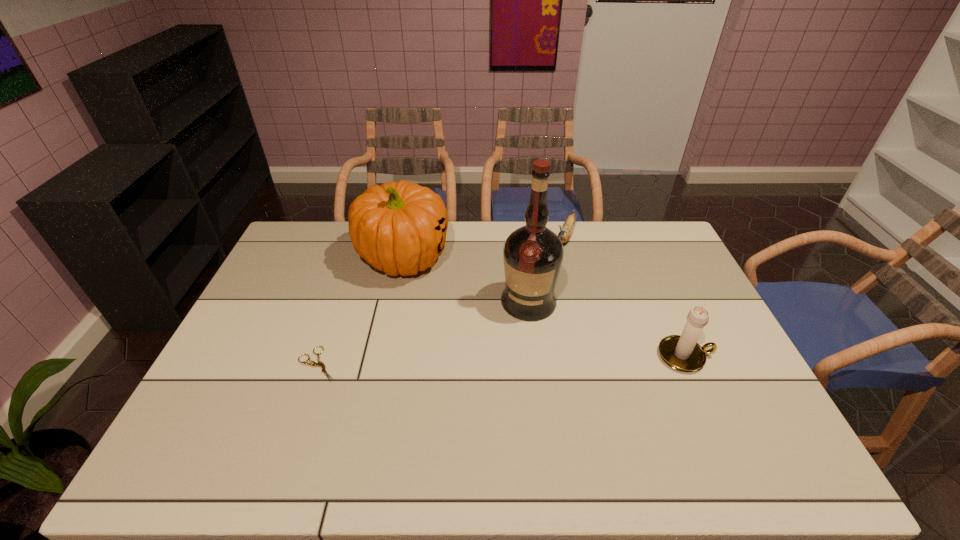
You are a GUI agent. You are given a task and a screenshot of the screen. Output one action in this format:
    pyautogui.click(x=<x>, y=<y>)
    Task: Click on the free point located on the surface of the liquor
    The image size is (960, 540).
    Given the screenshot: What is the action you would take?
    pyautogui.click(x=487, y=411)

Locate an element on the screen. vacant region located 0.050m on the surface of the liquor is located at coordinates (516, 333).

Locate an element on the screen. vacant space located at the stem of the fourth object from left to right is located at coordinates (544, 289).

Identify the location of vacant space situated 0.270m at the stem of the fourth object from left to right. This screenshot has height=540, width=960. (540, 296).

Image resolution: width=960 pixels, height=540 pixels. Find the location of `blank space located 0.120m at the stem of the fourth object from left to right`. blank space located 0.120m at the stem of the fourth object from left to right is located at coordinates (554, 269).

Locate an element on the screen. The image size is (960, 540). free point located 0.270m on the surface of the pumpkin is located at coordinates (444, 344).

The image size is (960, 540). What are the coordinates of `free location located on the surface of the pumpkin` in the screenshot? It's located at (421, 298).

At what (x,y) coordinates should I click in order to perform the action: click on vacant area situated 0.370m on the surface of the pumpkin. Please return your answer as a coordinate pair (x, y). The height and width of the screenshot is (540, 960). Looking at the image, I should click on (457, 370).

You are a GUI agent. You are given a task and a screenshot of the screen. Output one action in this format:
    pyautogui.click(x=<x>, y=<y>)
    Task: Click on the banana that is at the far edge
    This screenshot has height=540, width=960.
    Given the screenshot: What is the action you would take?
    pyautogui.click(x=565, y=234)

This screenshot has width=960, height=540. What are the coordinates of `pumpkin that is at the far edge` in the screenshot? It's located at (400, 227).